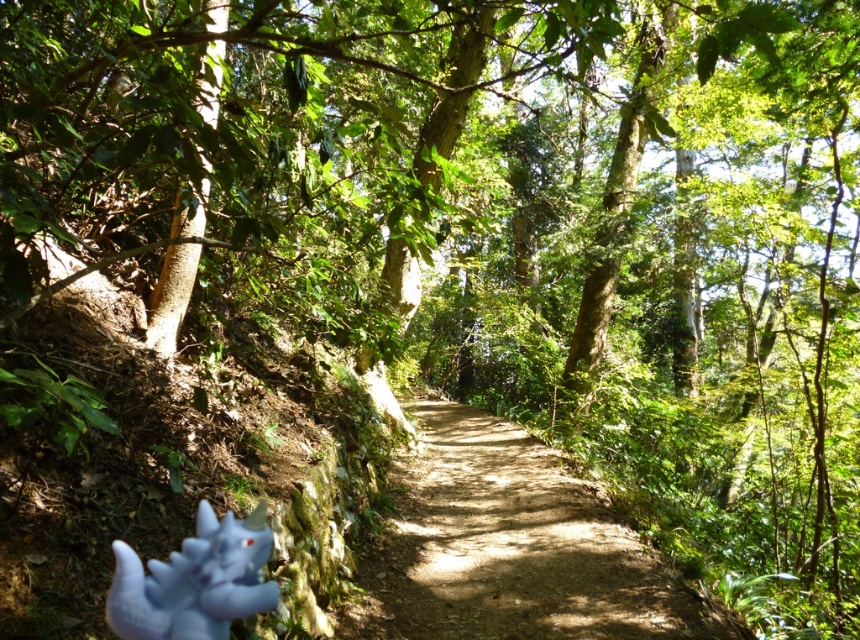
Question: From the image, what is the correct spatial relationship of dirt path at center in relation to blue plush toy at lower left?

Choices:
 (A) left
 (B) right

Answer: (B)

Question: Is dirt path at center in front of blue plush toy at lower left?

Choices:
 (A) yes
 (B) no

Answer: (B)

Question: Can you confirm if dirt path at center is positioned to the right of blue plush toy at lower left?

Choices:
 (A) yes
 (B) no

Answer: (A)

Question: Among these objects, which one is farthest from the camera?

Choices:
 (A) blue plush toy at lower left
 (B) dirt path at center

Answer: (B)

Question: Which object is farther from the camera taking this photo?

Choices:
 (A) dirt path at center
 (B) blue plush toy at lower left

Answer: (A)